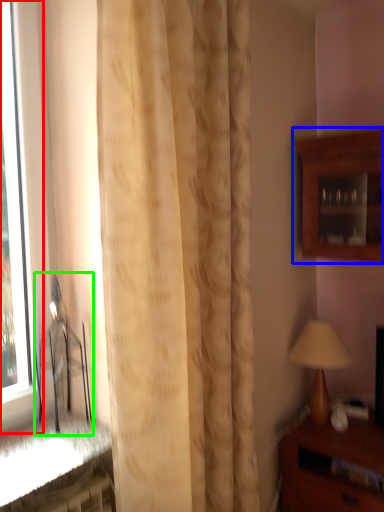
Question: Considering the real-world distances, which object is closest to window (highlighted by a red box)? cabinetry (highlighted by a blue box) or chair (highlighted by a green box).

Choices:
 (A) cabinetry
 (B) chair

Answer: (B)